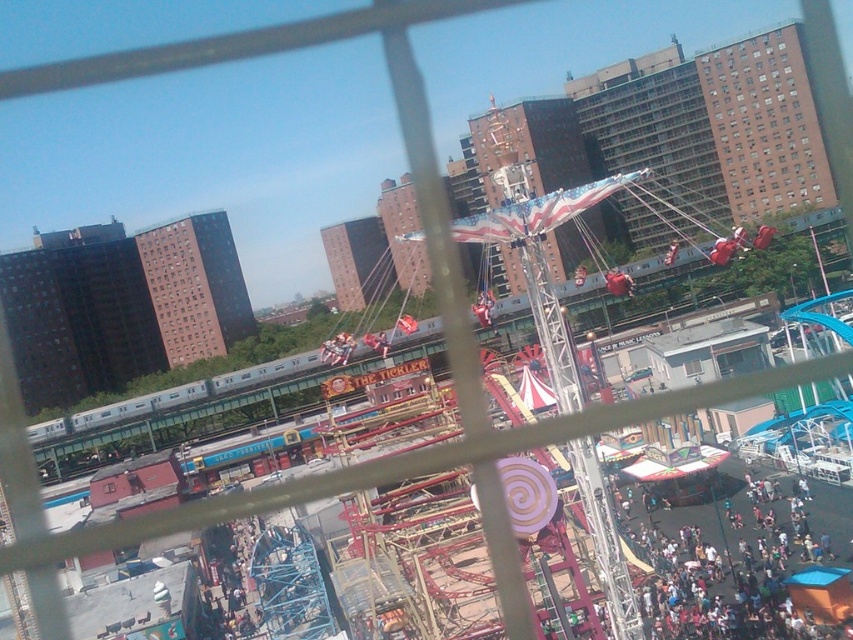
Question: Does dark blue fabric crowd at lower right lie in front of brown brick building at upper right?

Choices:
 (A) yes
 (B) no

Answer: (A)

Question: Which object is closer to the camera taking this photo?

Choices:
 (A) brown brick building at upper right
 (B) dark blue fabric crowd at lower right

Answer: (B)

Question: Considering the relative positions of dark blue fabric crowd at lower right and brown brick building at upper right in the image provided, where is dark blue fabric crowd at lower right located with respect to brown brick building at upper right?

Choices:
 (A) above
 (B) below

Answer: (B)

Question: Which of the following is the closest to the observer?

Choices:
 (A) brown brick building at upper right
 (B) dark blue fabric crowd at lower right

Answer: (B)

Question: Can you confirm if dark blue fabric crowd at lower right is positioned to the right of brown brick building at upper right?

Choices:
 (A) yes
 (B) no

Answer: (B)

Question: Which of the following is the closest to the observer?

Choices:
 (A) brown brick building at upper right
 (B) dark blue fabric crowd at lower right

Answer: (B)